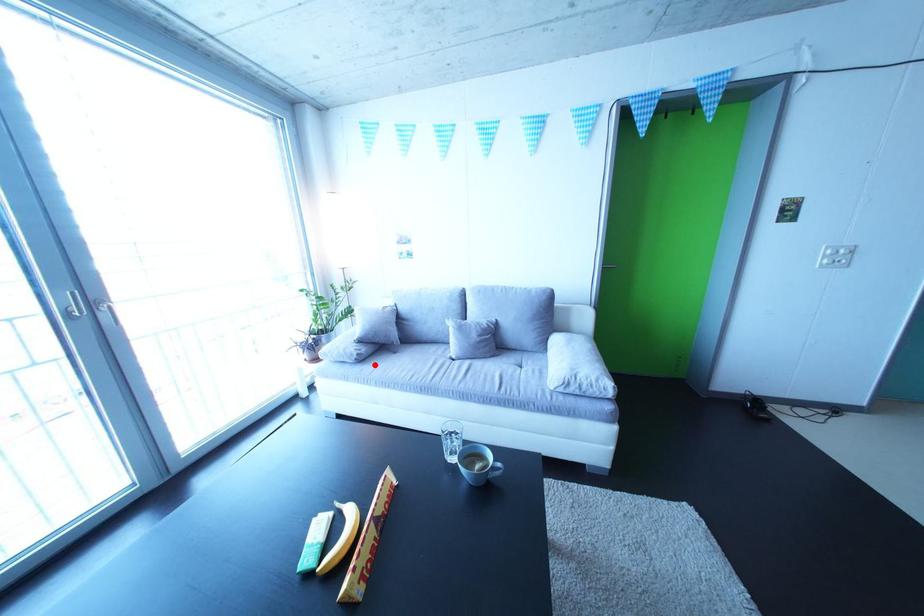
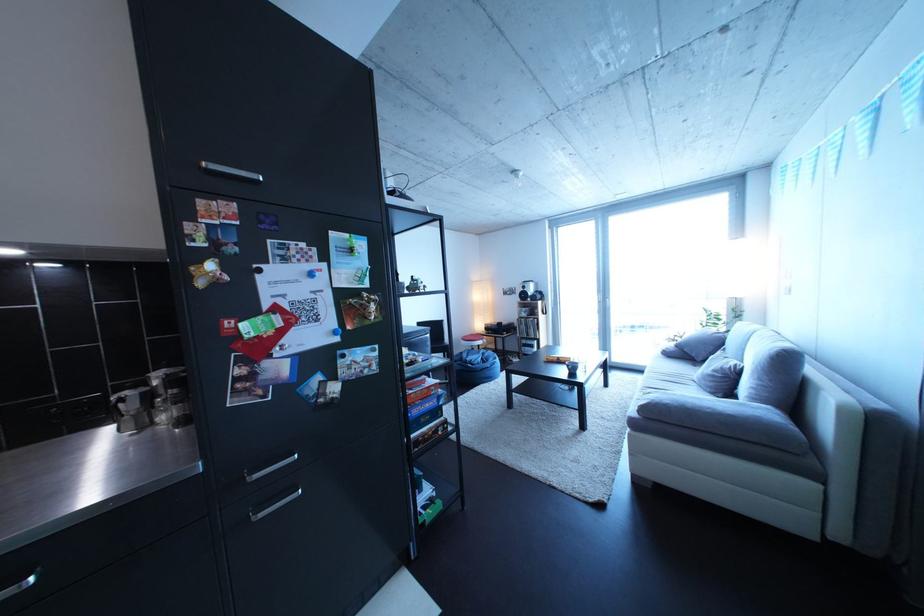
Question: I am providing you with two images of the same scene from different viewpoints. A red point is marked on the first image. Can you still see the location of the red point in image 2?

Choices:
 (A) Yes
 (B) No

Answer: (A)